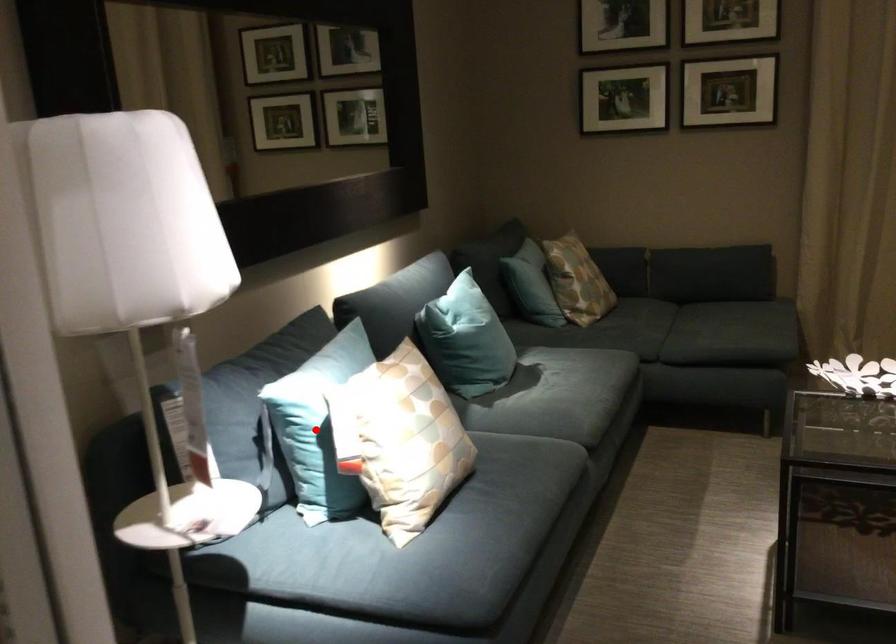
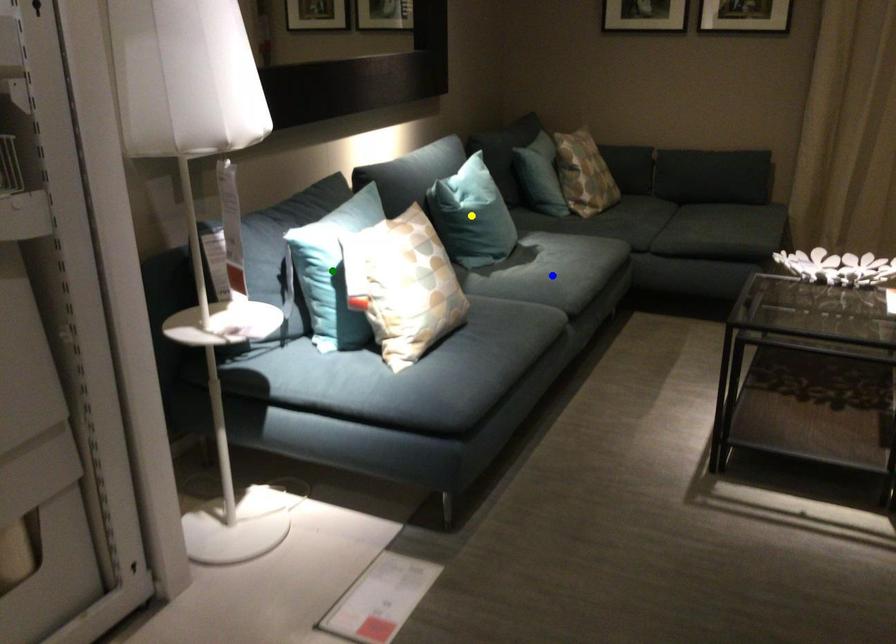
Question: I am providing you with two images of the same scene from different viewpoints. A red point is marked on the first image. You are given multiple points on the second image. Which point in image 2 is actually the same real-world point as the red point in image 1?

Choices:
 (A) yellow point
 (B) blue point
 (C) green point

Answer: (C)